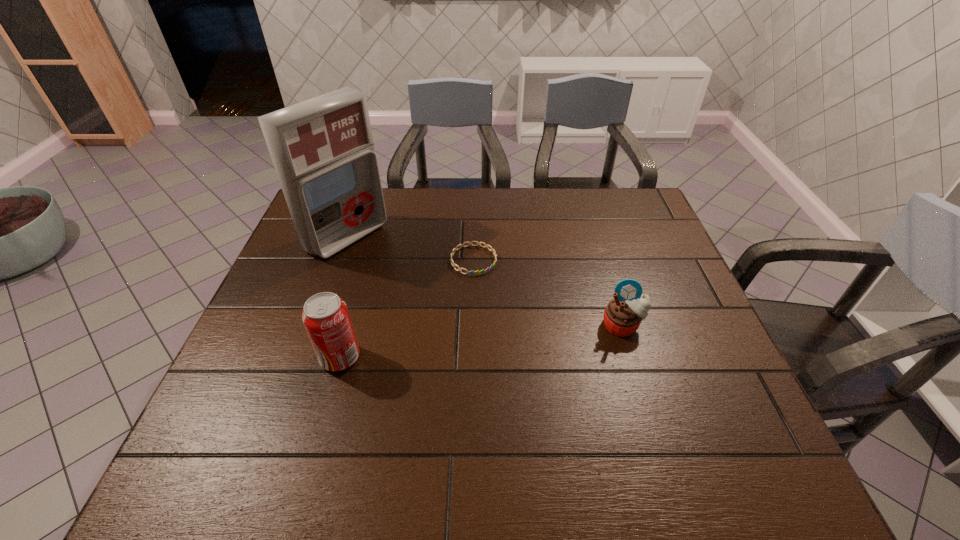
Where is `object at the far left corner`? The image size is (960, 540). object at the far left corner is located at coordinates (322, 149).

The width and height of the screenshot is (960, 540). Find the location of `vacant position at the far edge of the desktop`. vacant position at the far edge of the desktop is located at coordinates (391, 190).

The height and width of the screenshot is (540, 960). What are the coordinates of `free spot at the near edge of the desktop` in the screenshot? It's located at (481, 393).

Where is `free space at the left edge of the desktop`? Image resolution: width=960 pixels, height=540 pixels. free space at the left edge of the desktop is located at coordinates (293, 341).

The width and height of the screenshot is (960, 540). In order to click on free space at the right edge of the desktop in this screenshot , I will do [x=732, y=374].

At what (x,y) coordinates should I click in order to perform the action: click on free spot at the far right corner of the desktop. Please return your answer as a coordinate pair (x, y). This screenshot has width=960, height=540. Looking at the image, I should click on (635, 218).

Find the location of `free area in between the third shortest object and the third farthest object`. free area in between the third shortest object and the third farthest object is located at coordinates (481, 342).

At what (x,y) coordinates should I click in order to perform the action: click on free area in between the tallest object and the muffin. Please return your answer as a coordinate pair (x, y). The height and width of the screenshot is (540, 960). Looking at the image, I should click on (485, 281).

Image resolution: width=960 pixels, height=540 pixels. I want to click on vacant space in between the second tallest object and the tallest object, so click(344, 298).

The image size is (960, 540). Find the location of `vacant region between the shortest object and the second tallest object`. vacant region between the shortest object and the second tallest object is located at coordinates (407, 309).